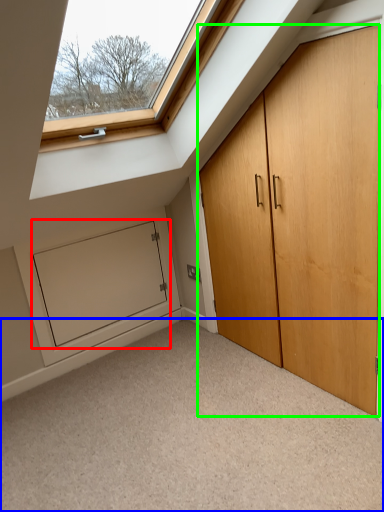
Question: Estimate the real-world distances between objects in this image. Which object is closer to screen door (highlighted by a red box), corridor (highlighted by a blue box) or door (highlighted by a green box)?

Choices:
 (A) corridor
 (B) door

Answer: (A)